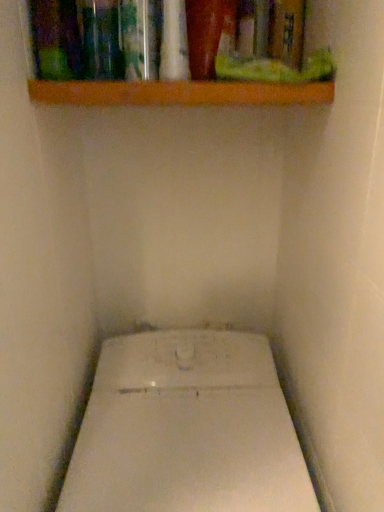
I want to click on white glossy toilet at center, so click(187, 429).

Describe the element at coordinates (187, 429) in the screenshot. The width and height of the screenshot is (384, 512). I see `white glossy toilet at center` at that location.

The image size is (384, 512). In order to click on wooden shelf at upper center in this screenshot , I will do `click(178, 93)`.

Image resolution: width=384 pixels, height=512 pixels. What do you see at coordinates (178, 93) in the screenshot?
I see `wooden shelf at upper center` at bounding box center [178, 93].

This screenshot has width=384, height=512. In order to click on white glossy toilet at center in this screenshot , I will do `click(187, 429)`.

Is white glossy toilet at center at the right side of wooden shelf at upper center?

Yes.

Is white glossy toilet at center in front of wooden shelf at upper center?

Yes, it is in front of wooden shelf at upper center.

Is point (115, 443) positioned in front of point (324, 90)?

No, it is not.

From the image's perspective, which is below, white glossy toilet at center or wooden shelf at upper center?

white glossy toilet at center.

From a real-world perspective, between white glossy toilet at center and wooden shelf at upper center, who is vertically lower?

white glossy toilet at center, from a real-world perspective.

Looking at their sizes, would you say white glossy toilet at center is wider or thinner than wooden shelf at upper center?

white glossy toilet at center is wider than wooden shelf at upper center.

Which of these two, white glossy toilet at center or wooden shelf at upper center, stands taller?

white glossy toilet at center is taller.

Does white glossy toilet at center have a larger size compared to wooden shelf at upper center?

Yes, white glossy toilet at center is bigger than wooden shelf at upper center.

Can wooden shelf at upper center be found inside white glossy toilet at center?

No.

Are white glossy toilet at center and wooden shelf at upper center making contact?

No, white glossy toilet at center is not making contact with wooden shelf at upper center.

Is wooden shelf at upper center at the back of white glossy toilet at center?

white glossy toilet at center is not turned away from wooden shelf at upper center.

What's the angular difference between white glossy toilet at center and wooden shelf at upper center's facing directions?

The angle between the facing direction of white glossy toilet at center and the facing direction of wooden shelf at upper center is 0.683 degrees.

Find the location of `shelf above the white glossy toilet at center (from a real-world perspective)`. shelf above the white glossy toilet at center (from a real-world perspective) is located at coordinates (178, 93).

Considering the relative positions of wooden shelf at upper center and white glossy toilet at center in the image provided, is wooden shelf at upper center to the left or to the right of white glossy toilet at center?

In the image, wooden shelf at upper center appears on the left side of white glossy toilet at center.

Between wooden shelf at upper center and white glossy toilet at center, which one is positioned behind?

wooden shelf at upper center is behind.

Which is closer, (314, 94) or (270, 479)?

Point (314, 94) is closer to the camera than point (270, 479).

From the image's perspective, is wooden shelf at upper center located above or below white glossy toilet at center?

wooden shelf at upper center is situated higher than white glossy toilet at center in the image.

From a real-world perspective, which is physically above, wooden shelf at upper center or white glossy toilet at center?

In real-world perspective, wooden shelf at upper center is above.

Based on the photo, which of these two, wooden shelf at upper center or white glossy toilet at center, is wider?

white glossy toilet at center is wider.

Who is shorter, wooden shelf at upper center or white glossy toilet at center?

Standing shorter between the two is wooden shelf at upper center.

Can you confirm if wooden shelf at upper center is smaller than white glossy toilet at center?

Yes, wooden shelf at upper center is smaller than white glossy toilet at center.

Can we say wooden shelf at upper center lies outside white glossy toilet at center?

Yes, wooden shelf at upper center is not within white glossy toilet at center.

Is wooden shelf at upper center next to white glossy toilet at center and touching it?

wooden shelf at upper center and white glossy toilet at center are clearly separated.

Is wooden shelf at upper center positioned with its back to white glossy toilet at center?

No, wooden shelf at upper center's orientation is not away from white glossy toilet at center.

Can you tell me how much wooden shelf at upper center and white glossy toilet at center differ in facing direction?

The facing directions of wooden shelf at upper center and white glossy toilet at center are 0.683 degrees apart.

Locate an element on the screen. The width and height of the screenshot is (384, 512). shelf behind the white glossy toilet at center is located at coordinates (178, 93).

You are a GUI agent. You are given a task and a screenshot of the screen. Output one action in this format:
    pyautogui.click(x=<x>, y=<y>)
    Task: Click on the toilet in front of the wooden shelf at upper center
    The image size is (384, 512).
    Given the screenshot: What is the action you would take?
    pyautogui.click(x=187, y=429)

Identify the location of shelf above the white glossy toilet at center (from the image's perspective). (178, 93).